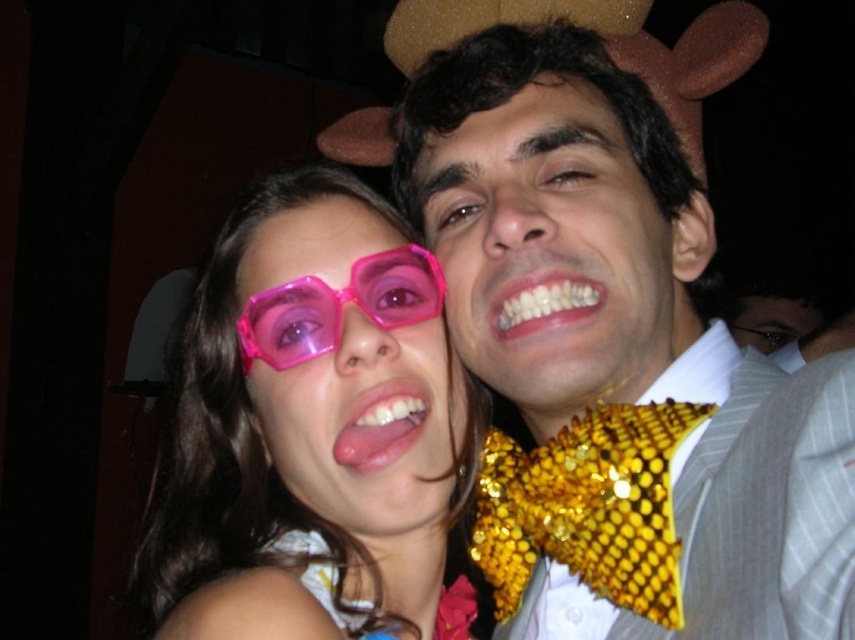
You are taking a photo of two people at a party. The camera you are using has a minimum focus distance of 20 inches. There is a point at coordinates point (665,232) that you need to ensure is in focus. Will the camera be able to focus on that point?

The point (665,232) is 21.16 inches from the camera, which is beyond the minimum focus distance of 20 inches. Therefore, the camera should be able to focus on that point.

In the scene shown: You are at the point labeled point (516, 136) and want to move to the point labeled point (817, 400). Which direction should you move in to reach your destination?

To reach point (817, 400) from point (516, 136), you should move towards the right and forward since point (817, 400) is in front of point (516, 136).